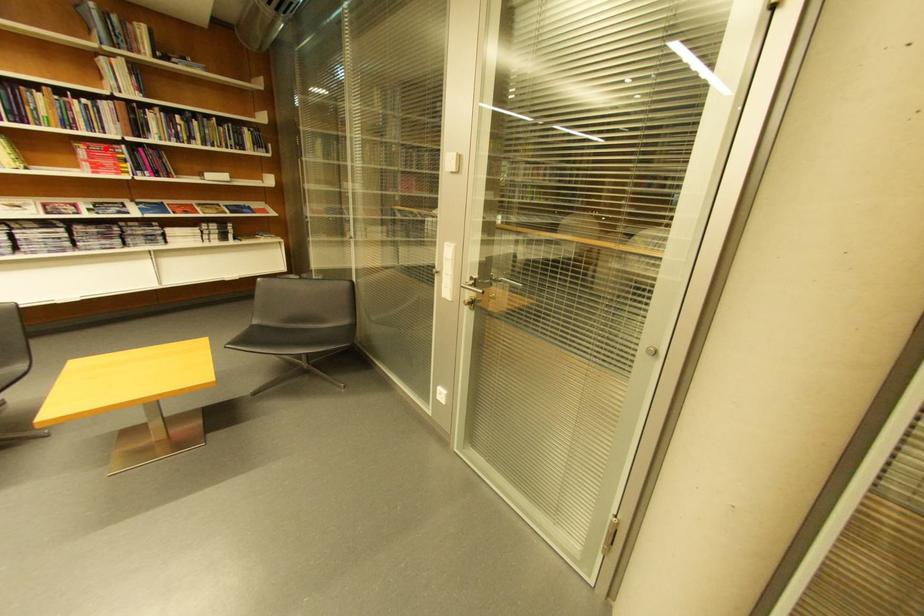
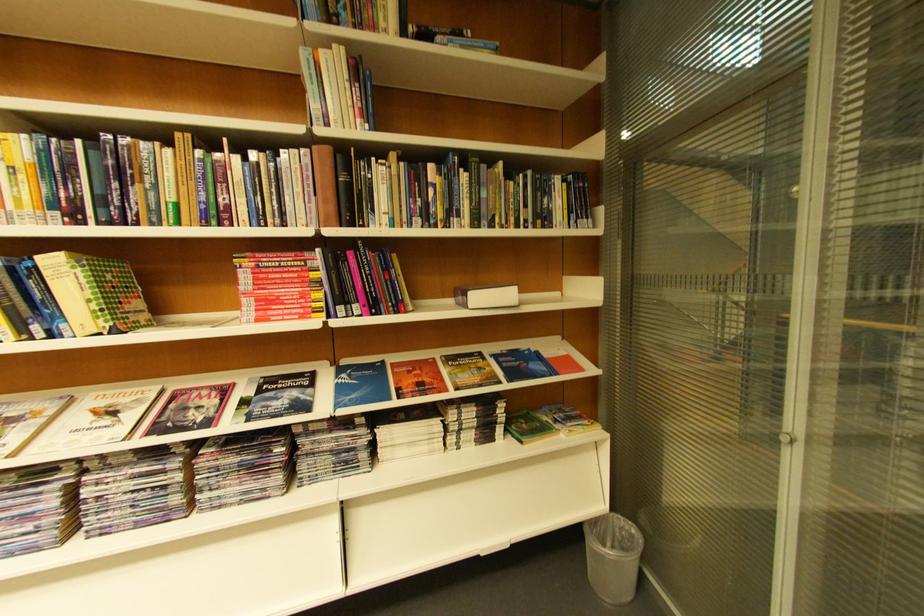
Question: I am providing you with two images of the same scene from different viewpoints. Given a red point in image1, look at the same physical point in image2. Is it:

Choices:
 (A) Closer to the viewpoint
 (B) Farther from the viewpoint

Answer: (A)